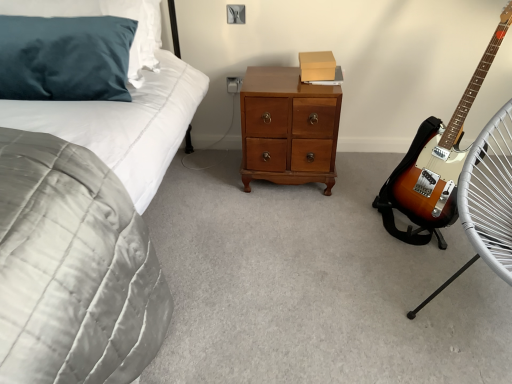
Question: Is velvet grey quilt at left taller than shiny brown wooden chest of drawers at center?

Choices:
 (A) no
 (B) yes

Answer: (B)

Question: Is velvet grey quilt at left wider than shiny brown wooden chest of drawers at center?

Choices:
 (A) no
 (B) yes

Answer: (B)

Question: Is velvet grey quilt at left turned away from shiny brown wooden chest of drawers at center?

Choices:
 (A) yes
 (B) no

Answer: (A)

Question: Does velvet grey quilt at left have a smaller size compared to shiny brown wooden chest of drawers at center?

Choices:
 (A) yes
 (B) no

Answer: (B)

Question: Could shiny brown wooden chest of drawers at center be considered to be inside velvet grey quilt at left?

Choices:
 (A) yes
 (B) no

Answer: (B)

Question: Considering the positions of velvet grey quilt at left and shiny brown wooden chest of drawers at center in the image, is velvet grey quilt at left taller or shorter than shiny brown wooden chest of drawers at center?

Choices:
 (A) short
 (B) tall

Answer: (B)

Question: From the image's perspective, is velvet grey quilt at left positioned above or below shiny brown wooden chest of drawers at center?

Choices:
 (A) below
 (B) above

Answer: (A)

Question: Considering the positions of velvet grey quilt at left and shiny brown wooden chest of drawers at center in the image, is velvet grey quilt at left bigger or smaller than shiny brown wooden chest of drawers at center?

Choices:
 (A) big
 (B) small

Answer: (A)

Question: Considering the positions of velvet grey quilt at left and shiny brown wooden chest of drawers at center in the image, is velvet grey quilt at left wider or thinner than shiny brown wooden chest of drawers at center?

Choices:
 (A) thin
 (B) wide

Answer: (B)

Question: Is shiny brown wooden chest of drawers at center taller or shorter than velvet grey quilt at left?

Choices:
 (A) short
 (B) tall

Answer: (A)

Question: Visually, is shiny brown wooden chest of drawers at center positioned to the left or to the right of velvet grey quilt at left?

Choices:
 (A) left
 (B) right

Answer: (B)

Question: Looking at the image, does shiny brown wooden chest of drawers at center seem bigger or smaller compared to velvet grey quilt at left?

Choices:
 (A) big
 (B) small

Answer: (B)

Question: Is shiny brown wooden chest of drawers at center wider or thinner than velvet grey quilt at left?

Choices:
 (A) wide
 (B) thin

Answer: (B)

Question: Looking at their shapes, would you say white plastic electric outlet at center is wider or thinner than satin white folding chair at right?

Choices:
 (A) wide
 (B) thin

Answer: (B)

Question: From a real-world perspective, relative to satin white folding chair at right, is white plastic electric outlet at center vertically above or below?

Choices:
 (A) above
 (B) below

Answer: (B)